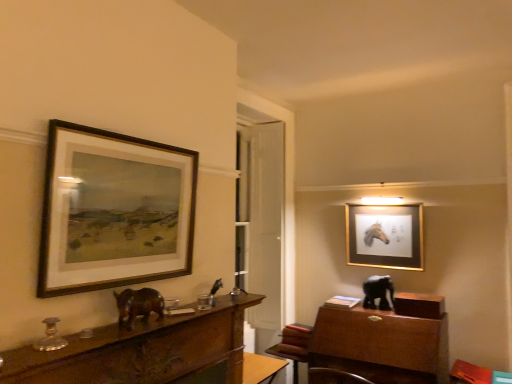
The width and height of the screenshot is (512, 384). What are the coordinates of `free location above gold metallic picture frame at upper right, which appears as the 1th picture frame when viewed from the back (from a real-world perspective)` in the screenshot? It's located at (386, 202).